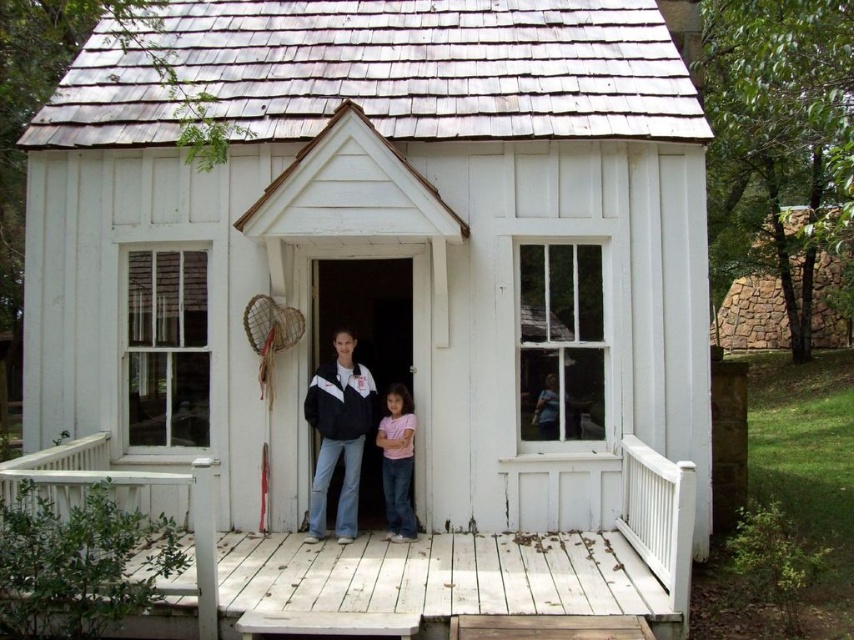
Question: Estimate the real-world distances between objects in this image. Which object is closer to the matte black jacket at center?

Choices:
 (A) pink cotton shirt at center
 (B) white wooden porch at center

Answer: (A)

Question: Which is farther from the pink cotton shirt at center?

Choices:
 (A) white wooden porch at center
 (B) matte black jacket at center

Answer: (A)

Question: Considering the relative positions of white wooden porch at center and pink cotton shirt at center in the image provided, where is white wooden porch at center located with respect to pink cotton shirt at center?

Choices:
 (A) below
 (B) above

Answer: (A)

Question: Is white wooden porch at center thinner than pink cotton shirt at center?

Choices:
 (A) no
 (B) yes

Answer: (A)

Question: Considering the real-world distances, which object is closest to the white wooden porch at center?

Choices:
 (A) pink cotton shirt at center
 (B) matte black jacket at center

Answer: (A)

Question: Is white wooden porch at center smaller than matte black jacket at center?

Choices:
 (A) no
 (B) yes

Answer: (A)